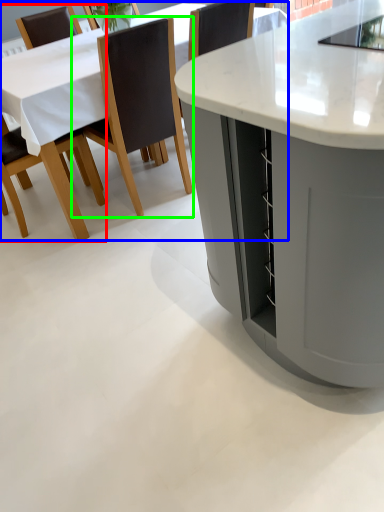
Question: Which object is the closest to the chair (highlighted by a red box)? Choose among these: table (highlighted by a blue box) or chair (highlighted by a green box).

Choices:
 (A) table
 (B) chair

Answer: (A)